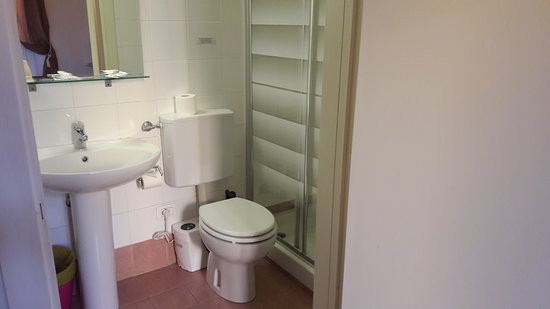
Where is `faucet`? faucet is located at coordinates (78, 140).